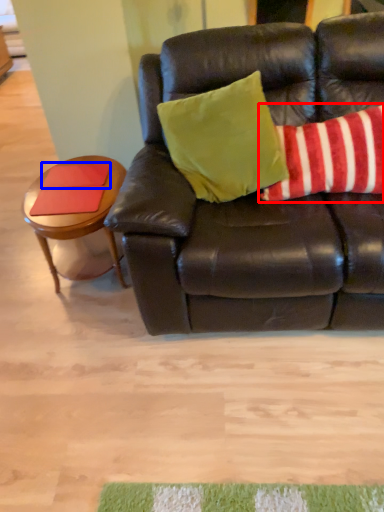
Question: Among these objects, which one is nearest to the camera, pillow (highlighted by a red box) or pad (highlighted by a blue box)?

Choices:
 (A) pillow
 (B) pad

Answer: (A)